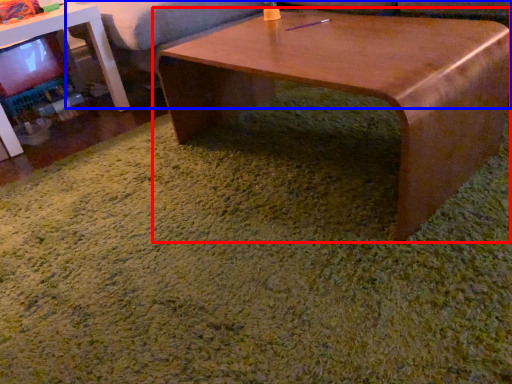
Question: Among these objects, which one is nearest to the camera, coffee table (highlighted by a red box) or couch (highlighted by a blue box)?

Choices:
 (A) coffee table
 (B) couch

Answer: (A)